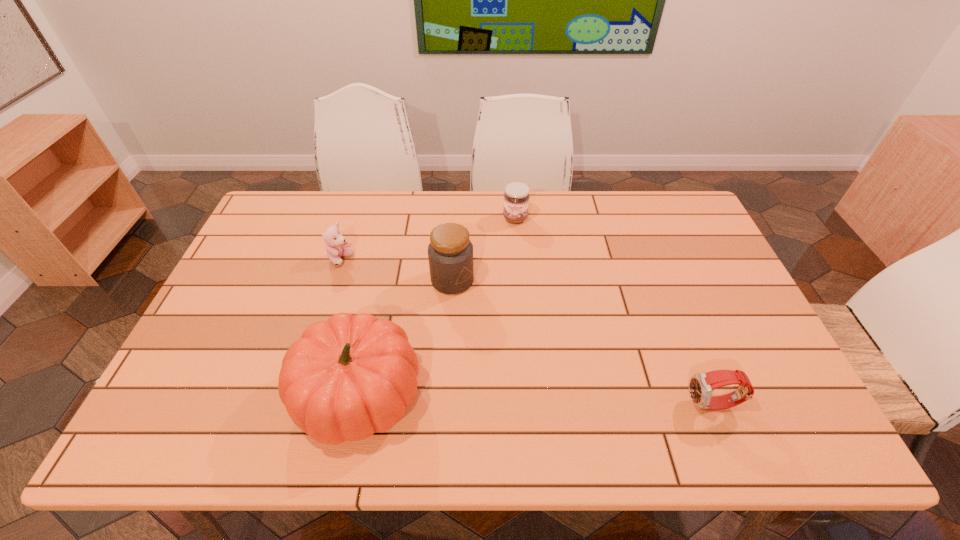
At what (x,y) coordinates should I click in order to perform the action: click on free spot that satisfies the following two spatial constraints: 1. on the front side of the watch; 2. on the face of the pumpkin. Please return your answer as a coordinate pair (x, y). Looking at the image, I should click on (355, 406).